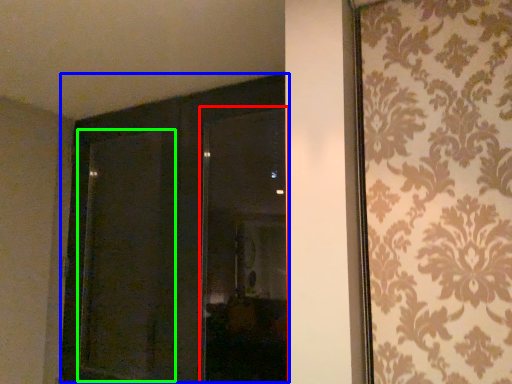
Question: Which object is the closest to the window (highlighted by a red box)? Choose among these: door (highlighted by a blue box) or screen door (highlighted by a green box).

Choices:
 (A) door
 (B) screen door

Answer: (A)